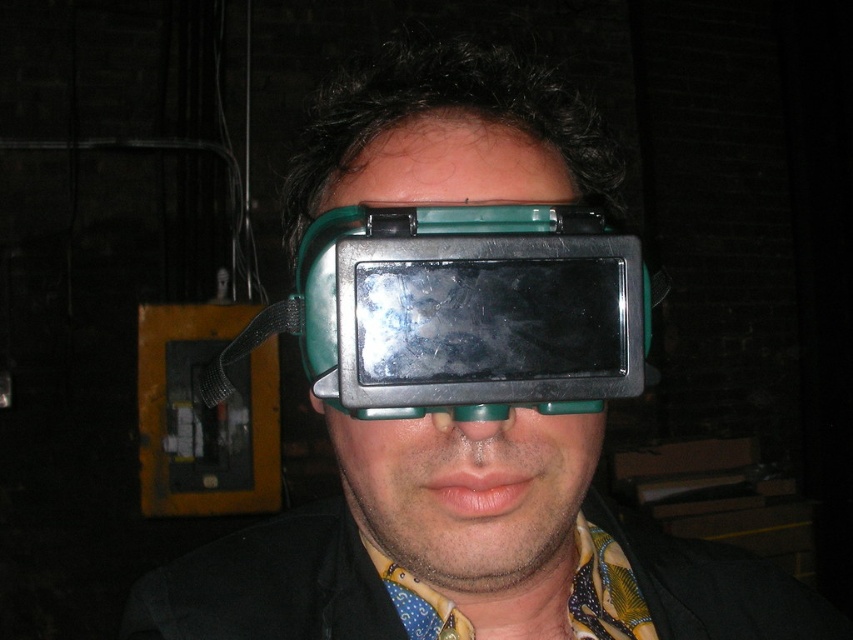
Consider the image. Which is below, green matte/glassy goggles at center or green plastic goggles at center?

Positioned lower is green plastic goggles at center.

Who is more distant from viewer, (451, 227) or (426, 461)?

The point (451, 227) is more distant.

Between point (409, 221) and point (546, 502), which one is positioned behind?

Point (546, 502)

This screenshot has height=640, width=853. Identify the location of green matte/glassy goggles at center. (471, 310).